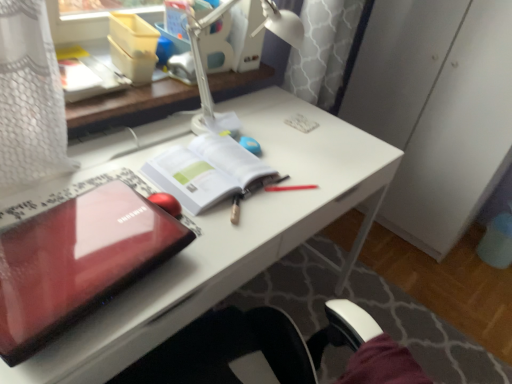
The image size is (512, 384). Describe the element at coordinates (226, 240) in the screenshot. I see `glossy plastic laptop at center-left` at that location.

Describe the element at coordinates (207, 171) in the screenshot. The image size is (512, 384). I see `white paper at center` at that location.

Locate an element on the screen. This screenshot has width=512, height=384. glossy plastic laptop at center-left is located at coordinates (226, 240).

Does white paper at center have a greater height compared to glossy plastic laptop at center-left?

No.

Which of these two, white paper at center or glossy plastic laptop at center-left, is smaller?

With smaller size is white paper at center.

From the image's perspective, is white paper at center positioned above or below glossy plastic laptop at center-left?

Clearly, from the image's perspective, white paper at center is above glossy plastic laptop at center-left.

Is white plastic lamp at upper center inside or outside of glossy plastic laptop at left?

white plastic lamp at upper center is not inside glossy plastic laptop at left, it's outside.

Between white plastic lamp at upper center and glossy plastic laptop at left, which one has larger size?

With larger size is white plastic lamp at upper center.

Considering the relative positions of white plastic lamp at upper center and glossy plastic laptop at left in the image provided, is white plastic lamp at upper center to the left of glossy plastic laptop at left from the viewer's perspective?

No.

Is there a large distance between white plastic lamp at upper center and glossy plastic laptop at center-left?

No, there isn't a large distance between white plastic lamp at upper center and glossy plastic laptop at center-left.

Does white plastic lamp at upper center appear on the left side of glossy plastic laptop at center-left?

In fact, white plastic lamp at upper center is to the right of glossy plastic laptop at center-left.

Based on the photo, is white plastic lamp at upper center located outside glossy plastic laptop at center-left?

Absolutely, white plastic lamp at upper center is external to glossy plastic laptop at center-left.

Is white plastic lamp at upper center wider than glossy plastic laptop at center-left?

No, white plastic lamp at upper center is not wider than glossy plastic laptop at center-left.

Does point (358, 130) come farther from viewer compared to point (291, 45)?

Yes, point (358, 130) is farther from viewer.

Considering the sizes of glossy plastic laptop at center-left and white plastic lamp at upper center in the image, is glossy plastic laptop at center-left wider or thinner than white plastic lamp at upper center?

Clearly, glossy plastic laptop at center-left has more width compared to white plastic lamp at upper center.

The image size is (512, 384). In the image, there is a glossy plastic laptop at center-left. In order to click on lamp above it (from the image's perspective) in this screenshot , I will do `click(207, 80)`.

Does glossy plastic laptop at center-left lie behind white plastic lamp at upper center?

No, glossy plastic laptop at center-left is in front of white plastic lamp at upper center.

Is white paper at center next to glossy plastic laptop at left and touching it?

No, white paper at center is not beside glossy plastic laptop at left.

Does white paper at center have a lesser height compared to glossy plastic laptop at left?

Yes, white paper at center is shorter than glossy plastic laptop at left.

Is white paper at center facing away from glossy plastic laptop at left?

No.

Between glossy plastic laptop at center-left and white paper at center, which one is positioned in front?

glossy plastic laptop at center-left is more forward.

How different are the orientations of glossy plastic laptop at center-left and white paper at center in degrees?

0.00047 degrees.

From a real-world perspective, which object rests below the other?

glossy plastic laptop at center-left.

From the picture: Is glossy plastic laptop at center-left situated inside white paper at center or outside?

glossy plastic laptop at center-left is outside white paper at center.

From the picture: Is glossy plastic laptop at left spatially inside white paper at center, or outside of it?

glossy plastic laptop at left cannot be found inside white paper at center.

Would you say glossy plastic laptop at left is a long distance from white paper at center?

No, glossy plastic laptop at left is in close proximity to white paper at center.

In the scene shown: Considering the sizes of objects glossy plastic laptop at left and white paper at center in the image provided, who is bigger, glossy plastic laptop at left or white paper at center?

glossy plastic laptop at left.

Which is behind, glossy plastic laptop at left or white paper at center?

Positioned behind is white paper at center.

In the image, there is a white paper at center. At what (x,y) coordinates should I click in order to perform the action: click on desk below it (from a real-world perspective). Please return your answer as a coordinate pair (x, y). Looking at the image, I should click on (226, 240).

This screenshot has height=384, width=512. Identify the location of lamp behind the glossy plastic laptop at left. (207, 80).

Looking at the image, which one is located closer to white paper at center, white plastic lamp at upper center or glossy plastic laptop at center-left?

Based on the image, glossy plastic laptop at center-left appears to be nearer to white paper at center.

Based on their spatial positions, is white plastic lamp at upper center or white paper at center closer to glossy plastic laptop at left?

Among the two, white paper at center is located nearer to glossy plastic laptop at left.

Based on their spatial positions, is white paper at center or white plastic lamp at upper center further from glossy plastic laptop at left?

white plastic lamp at upper center is further to glossy plastic laptop at left.

When comparing their distances from white plastic lamp at upper center, does white paper at center or glossy plastic laptop at center-left seem closer?

white paper at center lies closer to white plastic lamp at upper center than the other object.

Based on the photo, based on their spatial positions, is white plastic lamp at upper center or glossy plastic laptop at center-left closer to glossy plastic laptop at left?

Based on the image, glossy plastic laptop at center-left appears to be nearer to glossy plastic laptop at left.

Based on their spatial positions, is glossy plastic laptop at left or white paper at center closer to white plastic lamp at upper center?

white paper at center is positioned closer to the anchor white plastic lamp at upper center.

From the picture: Considering their positions, is glossy plastic laptop at center-left positioned closer to white plastic lamp at upper center than white paper at center?

Based on the image, white paper at center appears to be nearer to white plastic lamp at upper center.

Considering their positions, is white plastic lamp at upper center positioned further to white paper at center than glossy plastic laptop at left?

glossy plastic laptop at left is positioned further to the anchor white paper at center.

The height and width of the screenshot is (384, 512). Identify the location of desk positioned between glossy plastic laptop at left and white paper at center from near to far. (226, 240).

You are a GUI agent. You are given a task and a screenshot of the screen. Output one action in this format:
    pyautogui.click(x=<x>, y=<y>)
    Task: Click on the paperback book that lies between white plastic lamp at upper center and glossy plastic laptop at left from top to bottom
    
    Given the screenshot: What is the action you would take?
    click(207, 171)

Where is `laptop between white plastic lamp at upper center and glossy plastic laptop at center-left in the up-down direction`? The width and height of the screenshot is (512, 384). laptop between white plastic lamp at upper center and glossy plastic laptop at center-left in the up-down direction is located at coordinates (78, 262).

Locate an element on the screen. The height and width of the screenshot is (384, 512). paperback book between white plastic lamp at upper center and glossy plastic laptop at center-left in the vertical direction is located at coordinates (207, 171).